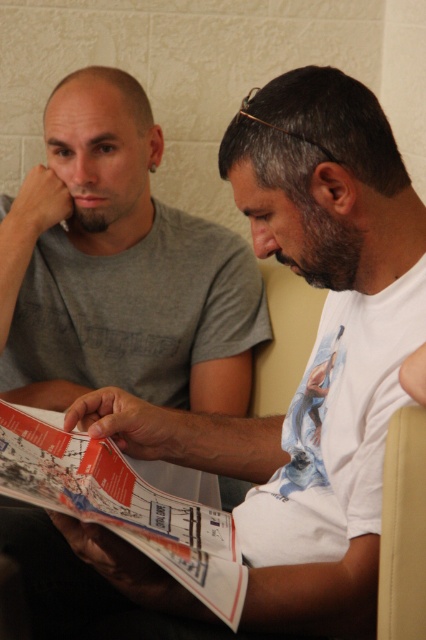
In the scene shown: What is the object located at the coordinate point (121, 504) in the image?

The object located at the coordinate point (121, 504) is the printed paper magazine at center.

You are standing at the camera position and want to reach the point marked as point [221,616]. If your arm can extend 30 inches, can you reach it without moving your feet?

The distance between you and point [221,616] is 32.27 inches, which is beyond your arm reach of 30 inches. You cannot reach it without moving your feet.

You are a delivery person who needs to place a rectangular box that is 1.2 meters wide on the printed paper magazine at center and the beige fabric armchair at right. Based on their widths, which object can accommodate the box?

The printed paper magazine at center has a greater width than the beige fabric armchair at right. Since the box is 1.2 meters wide, it can only fit on the printed paper magazine at center if its width is at least 1.2 meters. However, without knowing the exact width of the magazine, we cannot confirm. But since the magazine is wider than the armchair, the magazine is the better candidate for placing the box.